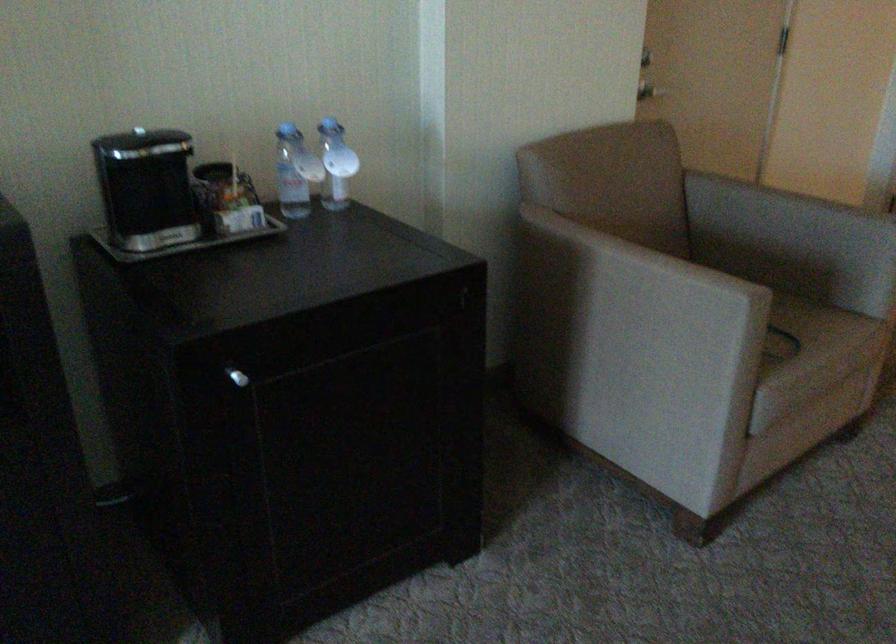
Identify the location of metal door handle. The image size is (896, 644). pyautogui.click(x=649, y=90).